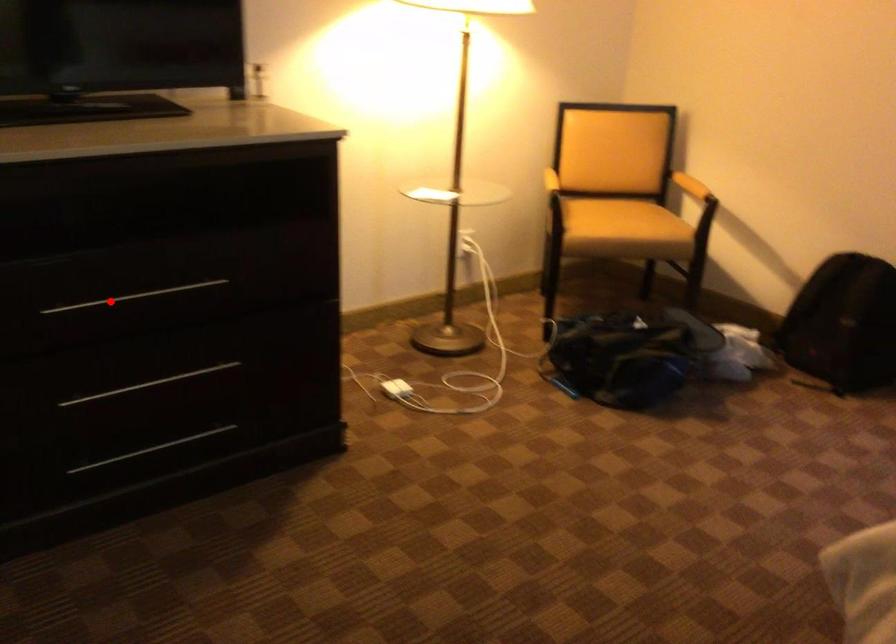
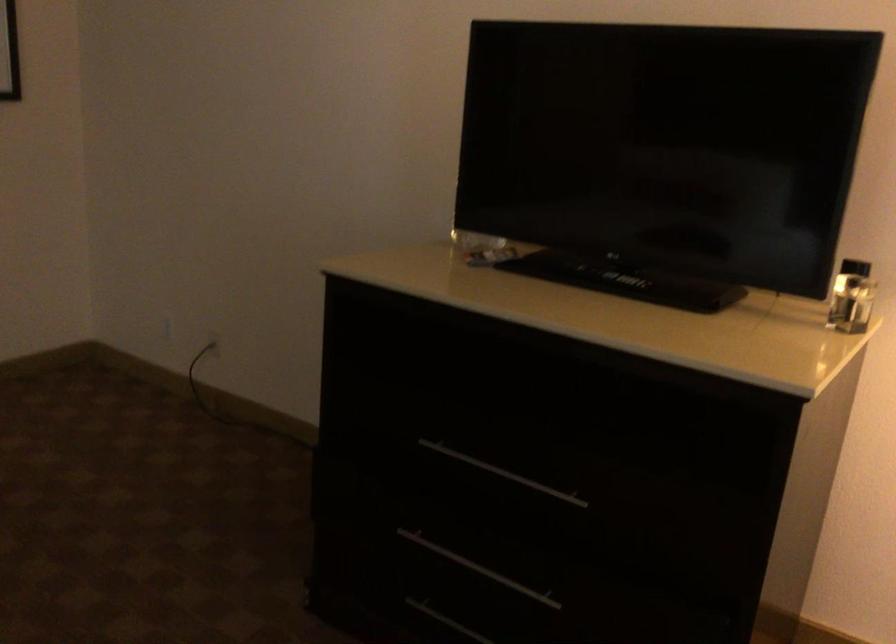
Find the pixel in the second image that matches the highlighted location in the first image.

(502, 473)